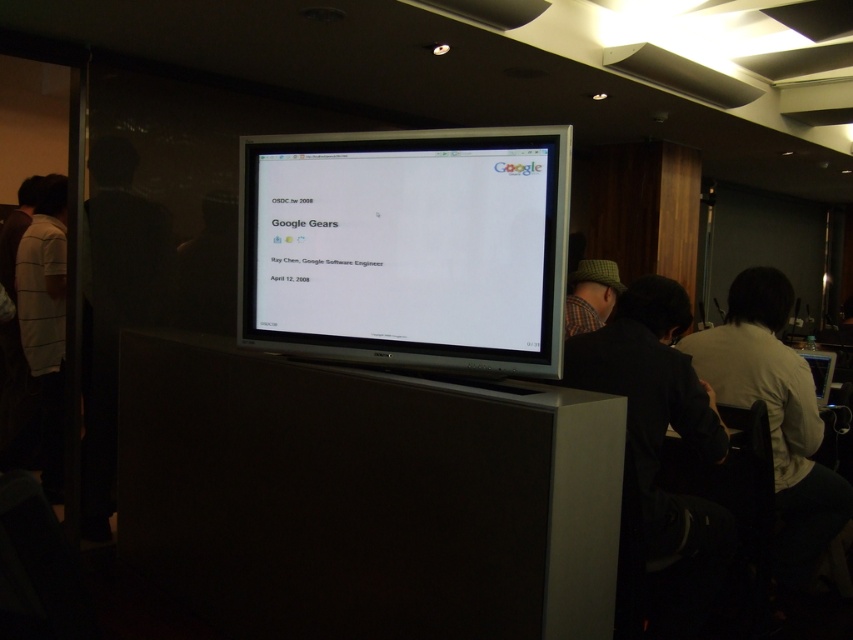
Between matte black monitor at center and green plaid hat at center, which one has more height?

Standing taller between the two is matte black monitor at center.

Is matte black monitor at center taller than green plaid hat at center?

Yes, matte black monitor at center is taller than green plaid hat at center.

Image resolution: width=853 pixels, height=640 pixels. I want to click on matte black monitor at center, so click(x=405, y=246).